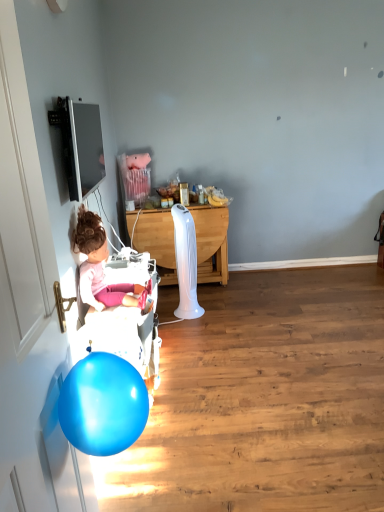
Where is `vacant space to the right of white plastic baby carriage at left`? The width and height of the screenshot is (384, 512). vacant space to the right of white plastic baby carriage at left is located at coordinates (217, 386).